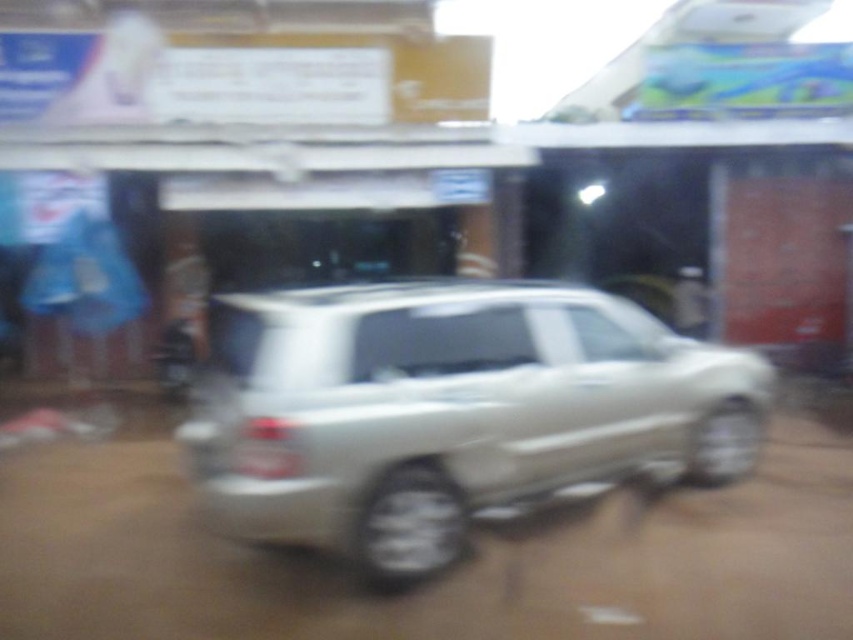
Question: Does satin silver suv at center lie behind white plastic license plate at center?

Choices:
 (A) yes
 (B) no

Answer: (A)

Question: Which point is closer to the camera?

Choices:
 (A) white plastic license plate at center
 (B) satin silver suv at center

Answer: (A)

Question: Considering the relative positions of satin silver suv at center and white plastic license plate at center in the image provided, where is satin silver suv at center located with respect to white plastic license plate at center?

Choices:
 (A) below
 (B) above

Answer: (B)

Question: Which point is farther from the camera taking this photo?

Choices:
 (A) (357, 444)
 (B) (274, 456)

Answer: (A)

Question: Which point is closer to the camera?

Choices:
 (A) (247, 448)
 (B) (502, 296)

Answer: (A)

Question: Can you confirm if satin silver suv at center is bigger than white plastic license plate at center?

Choices:
 (A) no
 (B) yes

Answer: (B)